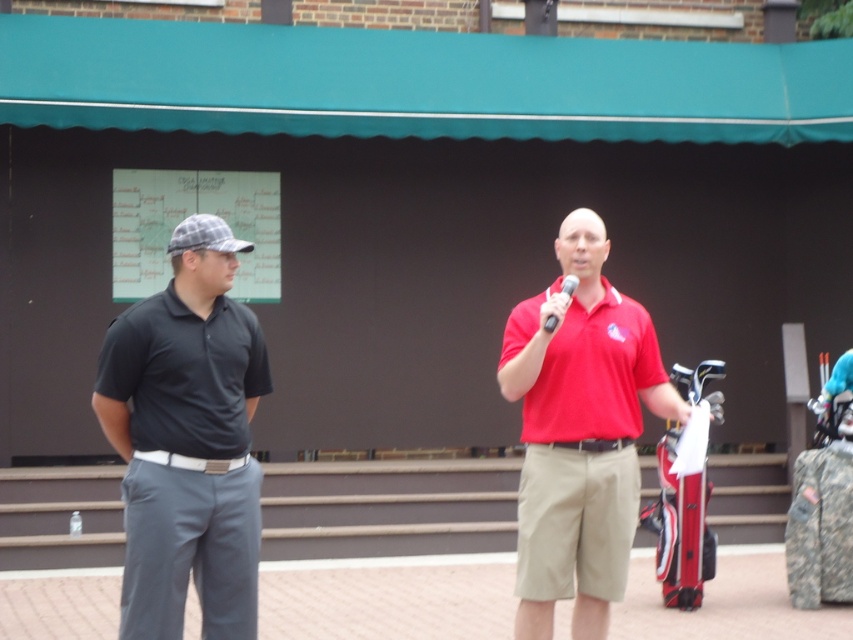
Question: Is matte red shirt at center smaller than metallic silver microphone at center?

Choices:
 (A) no
 (B) yes

Answer: (A)

Question: Does dark gray cotton polo shirt at left have a lesser width compared to metallic silver microphone at center?

Choices:
 (A) no
 (B) yes

Answer: (A)

Question: Which object appears farthest from the camera in this image?

Choices:
 (A) matte red polo shirt at center
 (B) metallic silver microphone at center

Answer: (A)

Question: Estimate the real-world distances between objects in this image. Which object is closer to the matte red shirt at center?

Choices:
 (A) metallic silver microphone at center
 (B) matte red polo shirt at center

Answer: (B)

Question: Which point is closer to the camera?

Choices:
 (A) matte red polo shirt at center
 (B) matte black polo shirt at left

Answer: (B)

Question: Can you confirm if dark gray cotton polo shirt at left is positioned below metallic silver microphone at center?

Choices:
 (A) no
 (B) yes

Answer: (B)